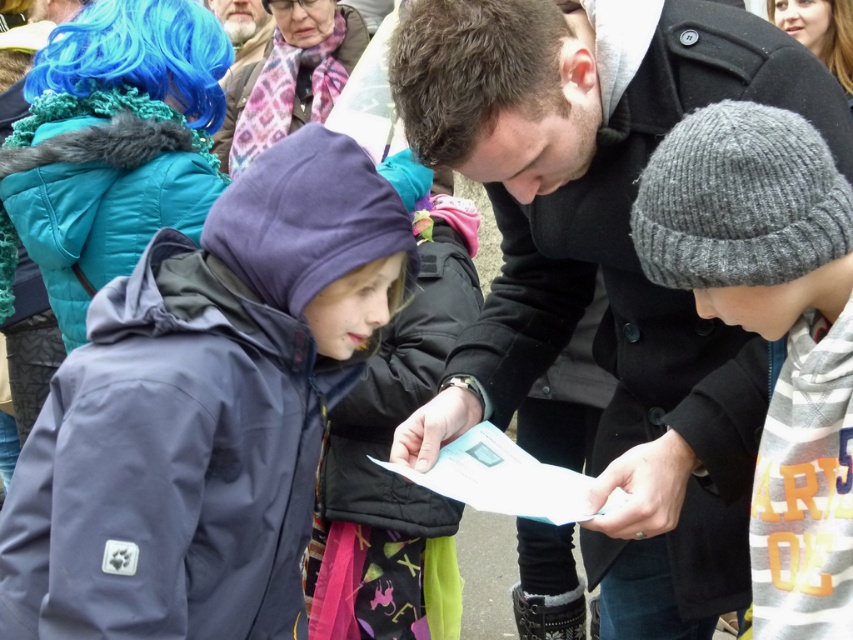
Is blue synthetic wig at upper left smaller than matte black coat at upper center?

Yes, blue synthetic wig at upper left is smaller than matte black coat at upper center.

What do you see at coordinates (471, 68) in the screenshot? The image size is (853, 640). I see `blue synthetic wig at upper left` at bounding box center [471, 68].

Which is behind, point (556, 108) or point (334, 65)?

Point (334, 65)

Identify the location of blue synthetic wig at upper left. (471, 68).

Between black wool coat at center and blue synthetic wig at upper right, which one has more height?

With more height is black wool coat at center.

Can you confirm if black wool coat at center is positioned above blue synthetic wig at upper right?

Actually, black wool coat at center is below blue synthetic wig at upper right.

What do you see at coordinates (605, 262) in the screenshot?
I see `black wool coat at center` at bounding box center [605, 262].

In order to click on black wool coat at center in this screenshot , I will do [605, 262].

In the scene shown: Can you confirm if black wool coat at center is shorter than blue synthetic wig at upper left?

No, black wool coat at center is not shorter than blue synthetic wig at upper left.

Between point (592, 262) and point (413, 122), which one is positioned in front?

Point (413, 122) is more forward.

I want to click on black wool coat at center, so click(605, 262).